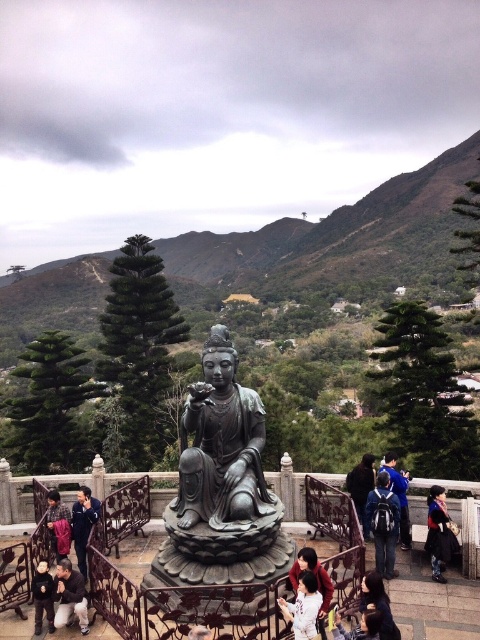
You are standing at the point marked by the coordinates point (398, 493) in the image. Looking around, you see a blue fabric backpack at center. What object are you currently standing on?

You are standing on the blue fabric backpack at center because the point (398, 493) is located on it.

You are a visitor at this serene outdoor location. You want to take a photo of the bronze statue at center and the white fabric at center together in the frame. Considering their sizes, which object should you focus on first to ensure both fit in the photo?

The bronze statue at center is bigger than the white fabric at center, so you should focus on the bronze statue at center first to ensure both fit in the photo.